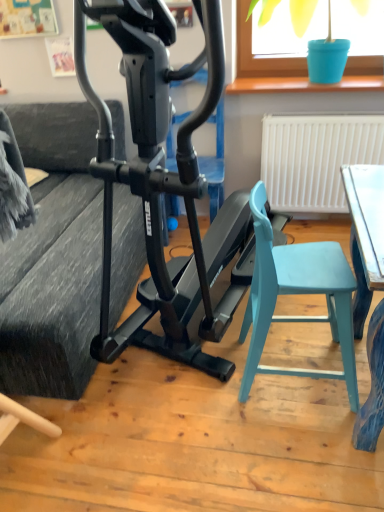
What do you see at coordinates (163, 184) in the screenshot? I see `black matte stationary bicycle at center` at bounding box center [163, 184].

The image size is (384, 512). What do you see at coordinates (297, 293) in the screenshot?
I see `light blue plastic chair at lower right` at bounding box center [297, 293].

At what (x,y) coordinates should I click in order to perform the action: click on black matte stationary bicycle at center. Please return your answer as a coordinate pair (x, y). Image resolution: width=384 pixels, height=512 pixels. Looking at the image, I should click on (163, 184).

Is textured gray couch at left located outside black matte stationary bicycle at center?

Yes, textured gray couch at left is not within black matte stationary bicycle at center.

Which is more to the left, textured gray couch at left or black matte stationary bicycle at center?

Positioned to the left is textured gray couch at left.

Considering the sizes of textured gray couch at left and black matte stationary bicycle at center in the image, is textured gray couch at left taller or shorter than black matte stationary bicycle at center?

textured gray couch at left is shorter than black matte stationary bicycle at center.

The height and width of the screenshot is (512, 384). In order to click on stationary bicycle on the left of blue plastic bucket at upper right in this screenshot , I will do `click(163, 184)`.

From a real-world perspective, is blue plastic bucket at upper right over black matte stationary bicycle at center?

Yes, from a real-world perspective, blue plastic bucket at upper right is above black matte stationary bicycle at center.

Which object is further away from the camera, blue plastic bucket at upper right or black matte stationary bicycle at center?

Positioned behind is blue plastic bucket at upper right.

Is blue plastic bucket at upper right aimed at black matte stationary bicycle at center?

Yes, blue plastic bucket at upper right is turned towards black matte stationary bicycle at center.

Can you tell me how much black matte stationary bicycle at center and textured gray couch at left differ in facing direction?

20.3 degrees.

Where is `stationary bicycle on the right of textured gray couch at left`? The image size is (384, 512). stationary bicycle on the right of textured gray couch at left is located at coordinates coord(163,184).

Can you confirm if black matte stationary bicycle at center is smaller than textured gray couch at left?

Correct, black matte stationary bicycle at center occupies less space than textured gray couch at left.

Considering the relative positions of light blue plastic chair at lower right and blue plastic bucket at upper right in the image provided, is light blue plastic chair at lower right to the right of blue plastic bucket at upper right from the viewer's perspective?

No.

From a real-world perspective, between light blue plastic chair at lower right and blue plastic bucket at upper right, who is vertically lower?

light blue plastic chair at lower right.

Is the position of light blue plastic chair at lower right more distant than that of blue plastic bucket at upper right?

No, it is in front of blue plastic bucket at upper right.

Is light blue plastic chair at lower right oriented towards blue plastic bucket at upper right?

No, light blue plastic chair at lower right is not aimed at blue plastic bucket at upper right.

From a real-world perspective, between textured gray couch at left and light blue plastic chair at lower right, who is vertically lower?

light blue plastic chair at lower right.

From the image's perspective, is textured gray couch at left positioned above or below light blue plastic chair at lower right?

Based on their image positions, textured gray couch at left is located above light blue plastic chair at lower right.

Is textured gray couch at left turned away from light blue plastic chair at lower right?

textured gray couch at left does not have its back to light blue plastic chair at lower right.

Is textured gray couch at left completely or partially outside of light blue plastic chair at lower right?

Yes, textured gray couch at left is not within light blue plastic chair at lower right.

In the image, is blue plastic bucket at upper right positioned in front of or behind light blue plastic chair at lower right?

blue plastic bucket at upper right is positioned farther from the viewer than light blue plastic chair at lower right.

From a real-world perspective, is blue plastic bucket at upper right physically located above or below light blue plastic chair at lower right?

blue plastic bucket at upper right is above light blue plastic chair at lower right.

Which of these two, blue plastic bucket at upper right or light blue plastic chair at lower right, stands shorter?

With less height is blue plastic bucket at upper right.

Identify the location of stationary bicycle below the blue plastic bucket at upper right (from a real-world perspective). The width and height of the screenshot is (384, 512). (163, 184).

In the image, is black matte stationary bicycle at center positioned in front of or behind blue plastic bucket at upper right?

black matte stationary bicycle at center is positioned closer to the viewer than blue plastic bucket at upper right.

Is black matte stationary bicycle at center positioned with its back to blue plastic bucket at upper right?

Yes, black matte stationary bicycle at center is facing away from blue plastic bucket at upper right.

Can you tell me how much black matte stationary bicycle at center and blue plastic bucket at upper right differ in facing direction?

There is a 20.7-degree angle between the facing directions of black matte stationary bicycle at center and blue plastic bucket at upper right.

I want to click on couch on the left side of black matte stationary bicycle at center, so click(x=53, y=258).

Locate an element on the screen. The width and height of the screenshot is (384, 512). window screen on the right side of black matte stationary bicycle at center is located at coordinates (261, 58).

Which object lies nearer to the anchor point light blue plastic chair at lower right, black matte stationary bicycle at center or blue plastic bucket at upper right?

Among the two, black matte stationary bicycle at center is located nearer to light blue plastic chair at lower right.

Based on their spatial positions, is textured gray couch at left or light blue plastic chair at lower right closer to black matte stationary bicycle at center?

light blue plastic chair at lower right.

Based on their spatial positions, is light blue plastic chair at lower right or black matte stationary bicycle at center further from blue plastic bucket at upper right?

light blue plastic chair at lower right is positioned further to the anchor blue plastic bucket at upper right.

When comparing their distances from textured gray couch at left, does black matte stationary bicycle at center or blue plastic bucket at upper right seem further?

blue plastic bucket at upper right.

Consider the image. Which object lies further to the anchor point textured gray couch at left, blue plastic bucket at upper right or black matte stationary bicycle at center?

blue plastic bucket at upper right is further to textured gray couch at left.

Considering their positions, is black matte stationary bicycle at center positioned closer to blue plastic bucket at upper right than textured gray couch at left?

textured gray couch at left lies closer to blue plastic bucket at upper right than the other object.

In the scene shown: Considering their positions, is blue plastic bucket at upper right positioned further to textured gray couch at left than light blue plastic chair at lower right?

blue plastic bucket at upper right is further to textured gray couch at left.

When comparing their distances from black matte stationary bicycle at center, does light blue plastic chair at lower right or textured gray couch at left seem further?

textured gray couch at left is positioned further to the anchor black matte stationary bicycle at center.

The width and height of the screenshot is (384, 512). What are the coordinates of `folding chair between textured gray couch at left and blue plastic bucket at upper right in the horizontal direction` in the screenshot? It's located at (297, 293).

Locate an element on the screen. The image size is (384, 512). stationary bicycle located between textured gray couch at left and light blue plastic chair at lower right in the left-right direction is located at coordinates (163, 184).

I want to click on stationary bicycle between textured gray couch at left and blue plastic bucket at upper right, so click(163, 184).

This screenshot has width=384, height=512. In order to click on stationary bicycle between blue plastic bucket at upper right and light blue plastic chair at lower right vertically in this screenshot , I will do `click(163, 184)`.